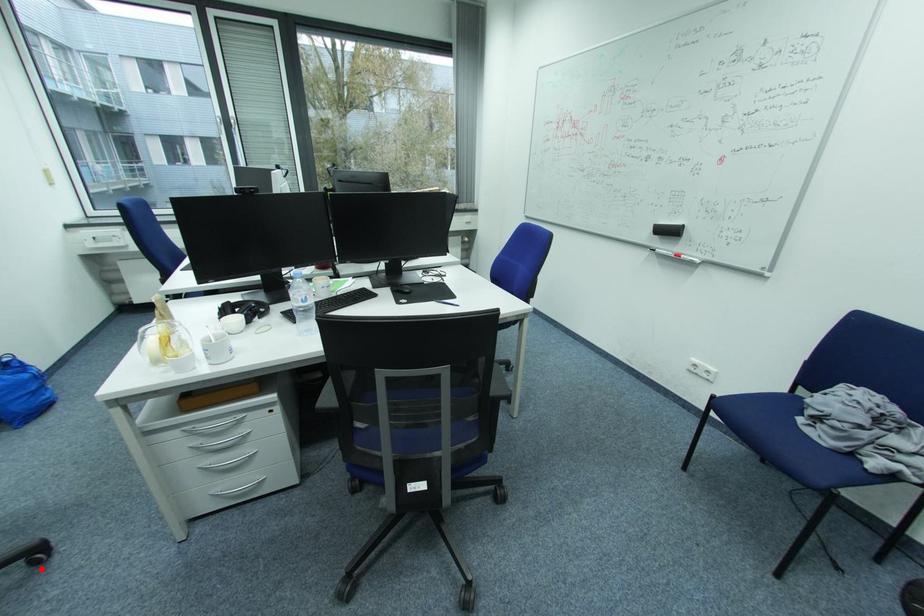
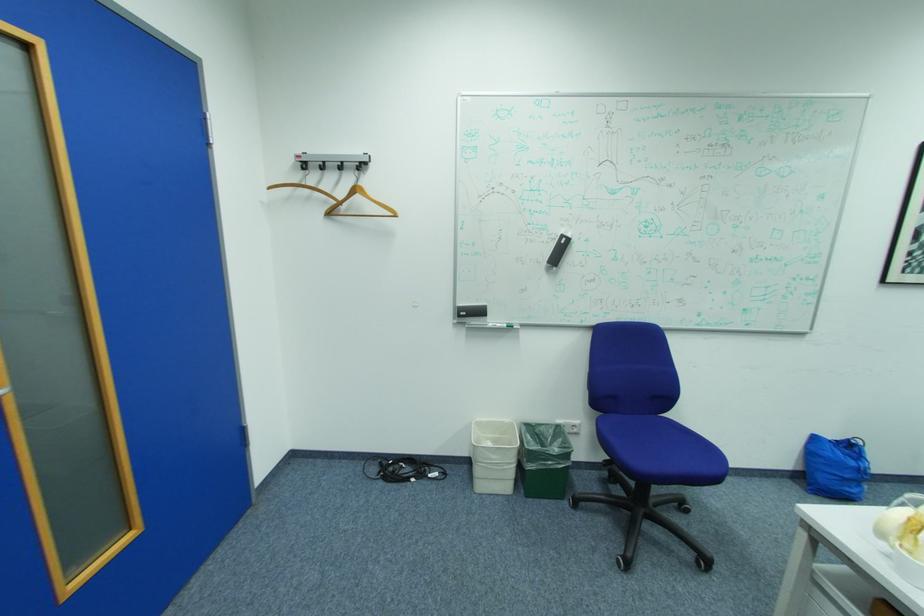
Question: I am providing you with two images of the same scene from different viewpoints. A red point is marked on the first image. At the location where the point appears in image 1, is it still visible in image 2?

Choices:
 (A) Yes
 (B) No

Answer: (A)